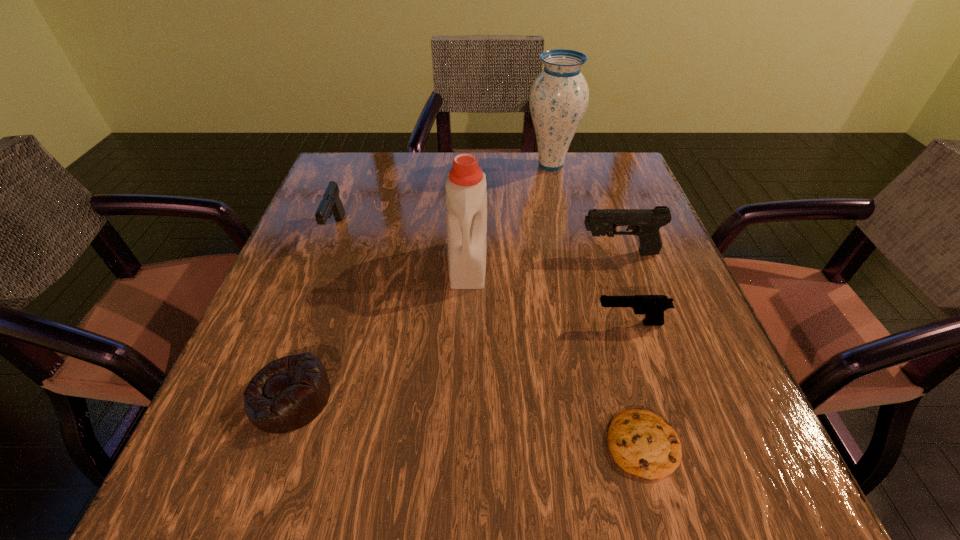
Find the location of `beanbag`. beanbag is located at coordinates (288, 393).

Locate an element on the screen. cookie is located at coordinates (x=642, y=443).

The width and height of the screenshot is (960, 540). I want to click on blank area located 0.310m on the left of the vase, so click(x=405, y=165).

The image size is (960, 540). I want to click on free location located on the handle side of the second tallest object, so click(x=467, y=315).

Locate an element on the screen. free space located at the barrel of the fifth shortest object is located at coordinates (418, 253).

Where is `vacant space located at the barrel of the fifth shortest object`? The width and height of the screenshot is (960, 540). vacant space located at the barrel of the fifth shortest object is located at coordinates (437, 253).

Where is `vacant space situated 0.170m at the barrel of the fifth shortest object`? vacant space situated 0.170m at the barrel of the fifth shortest object is located at coordinates (496, 253).

At what (x,y) coordinates should I click in order to perform the action: click on free space located aim along the barrel of the fourth shortest object. Please return your answer as a coordinate pair (x, y). This screenshot has height=540, width=960. Looking at the image, I should click on (269, 406).

Identify the location of vacant space located 0.060m on the front-facing side of the shortest pistol. This screenshot has height=540, width=960. (560, 323).

Where is `vacant area situated 0.110m on the front-facing side of the shortest pistol`? The height and width of the screenshot is (540, 960). vacant area situated 0.110m on the front-facing side of the shortest pistol is located at coordinates (531, 323).